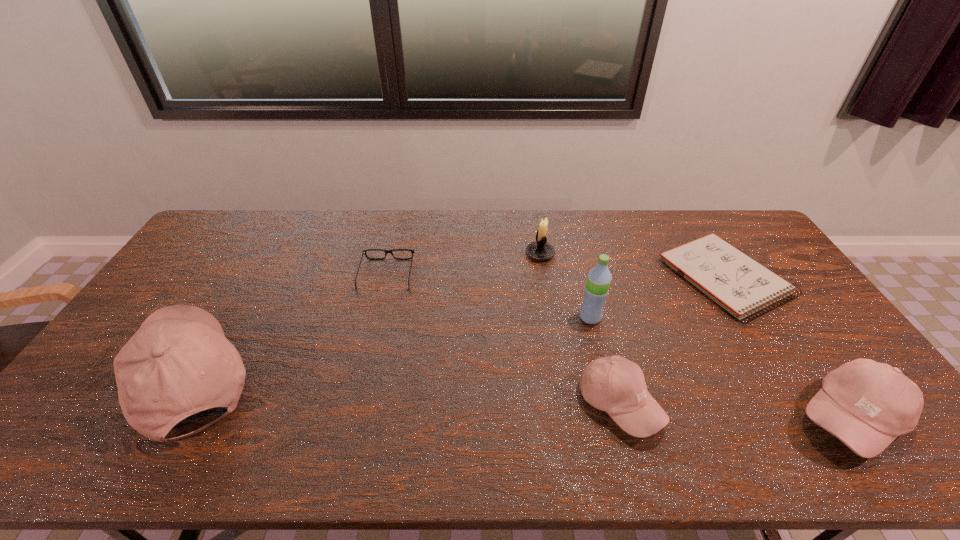
At what (x,y) coordinates should I click in order to perform the action: click on notepad located at the far edge. Please return your answer as a coordinate pair (x, y). The height and width of the screenshot is (540, 960). Looking at the image, I should click on click(x=741, y=285).

Find the location of `object that is at the left edge`. object that is at the left edge is located at coordinates (179, 362).

I want to click on baseball cap located at the right edge, so click(x=867, y=405).

This screenshot has height=540, width=960. In order to click on notepad situated at the right edge in this screenshot , I will do `click(741, 285)`.

You are a GUI agent. You are given a task and a screenshot of the screen. Output one action in this format:
    pyautogui.click(x=<x>, y=<y>)
    Task: Click on the object situated at the near left corner
    Image resolution: width=960 pixels, height=540 pixels.
    Given the screenshot: What is the action you would take?
    pyautogui.click(x=179, y=362)

Find the location of a particular element. object that is at the far right corner is located at coordinates click(741, 285).

At what (x,y) coordinates should I click in order to perform the action: click on object situated at the near right corner. Please return your answer as a coordinate pair (x, y). The height and width of the screenshot is (540, 960). Looking at the image, I should click on (867, 405).

This screenshot has width=960, height=540. In the image, there is a desktop. What are the coordinates of `vacant space at the far edge` in the screenshot? It's located at (302, 231).

Where is `free space at the near edge of the desktop`? The image size is (960, 540). free space at the near edge of the desktop is located at coordinates (745, 417).

This screenshot has height=540, width=960. Identify the location of free space at the left edge. (99, 374).